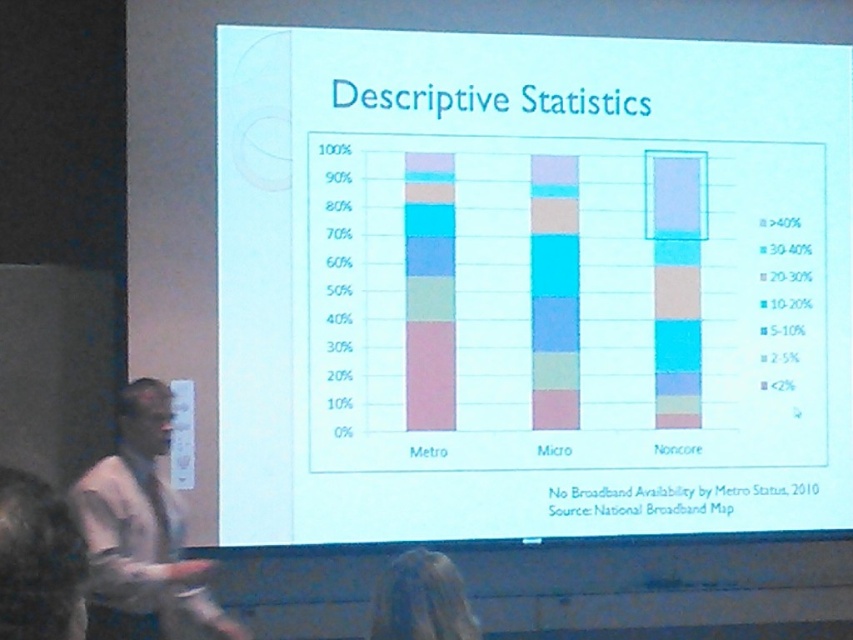
Question: Can you confirm if white paper at center is positioned to the right of blonde hair at lower center?

Choices:
 (A) yes
 (B) no

Answer: (A)

Question: Which object appears closest to the camera in this image?

Choices:
 (A) blonde hair at lower center
 (B) white paper at center

Answer: (A)

Question: Does white paper at center appear over white shirt at left?

Choices:
 (A) yes
 (B) no

Answer: (A)

Question: Which object appears farthest from the camera in this image?

Choices:
 (A) white shirt at left
 (B) blonde hair at lower center

Answer: (A)

Question: Is white paper at center wider than blonde hair at lower center?

Choices:
 (A) yes
 (B) no

Answer: (A)

Question: Which object is the farthest from the white paper at center?

Choices:
 (A) white shirt at left
 (B) blonde hair at lower center

Answer: (B)